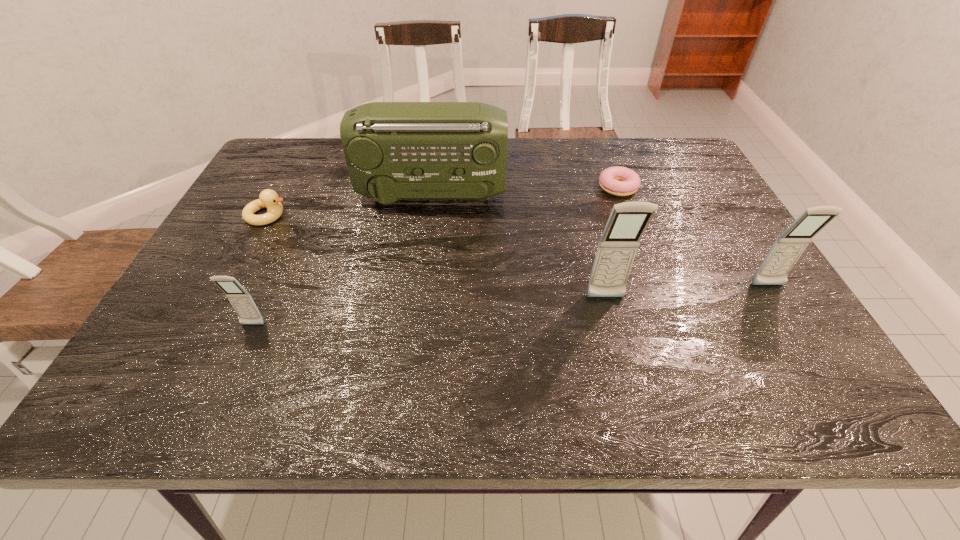
The height and width of the screenshot is (540, 960). Identify the location of the fifth object from right to left. (242, 302).

This screenshot has width=960, height=540. I want to click on the leftmost cellular telephone, so click(x=242, y=302).

At what (x,y) coordinates should I click in order to perform the action: click on the second cellular telephone from right to left. Please return your answer as a coordinate pair (x, y). The image size is (960, 540). Looking at the image, I should click on (617, 248).

Locate an element on the screen. Image resolution: width=960 pixels, height=540 pixels. the second farthest cellular telephone is located at coordinates (617, 248).

Find the location of a particular element. The width and height of the screenshot is (960, 540). the rightmost cellular telephone is located at coordinates (789, 246).

This screenshot has height=540, width=960. What are the coordinates of `the farthest cellular telephone` in the screenshot? It's located at (789, 246).

You are a GUI agent. You are given a task and a screenshot of the screen. Output one action in this format:
    pyautogui.click(x=<x>, y=<y>)
    Task: Click on the doughnut
    Image resolution: width=960 pixels, height=540 pixels.
    Given the screenshot: What is the action you would take?
    pyautogui.click(x=619, y=181)

At what (x,y) coordinates should I click in order to perform the action: click on the second object from right to left. Please return your answer as a coordinate pair (x, y). The image size is (960, 540). Looking at the image, I should click on (619, 181).

What are the coordinates of `radio_receiver` in the screenshot? It's located at (394, 151).

Identify the location of duckling. The width and height of the screenshot is (960, 540). (268, 198).